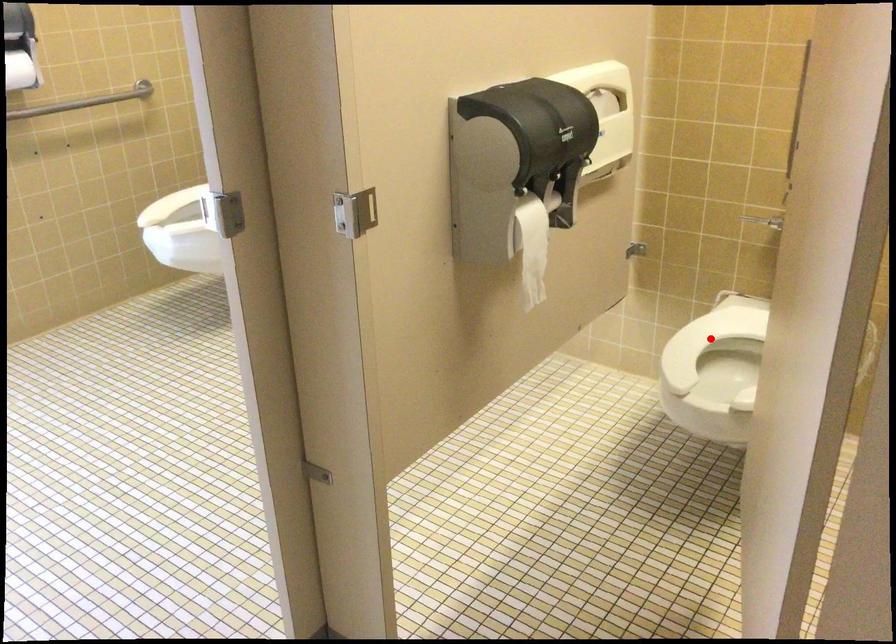
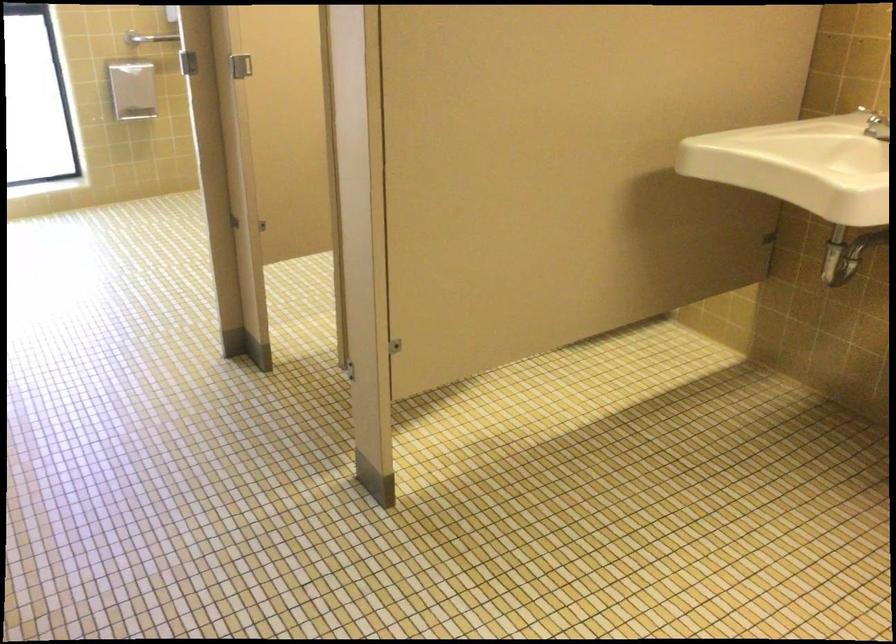
Question: I am providing you with two images of the same scene from different viewpoints. A red point is marked on the first image. Can you still see the location of the red point in image 2?

Choices:
 (A) Yes
 (B) No

Answer: (B)